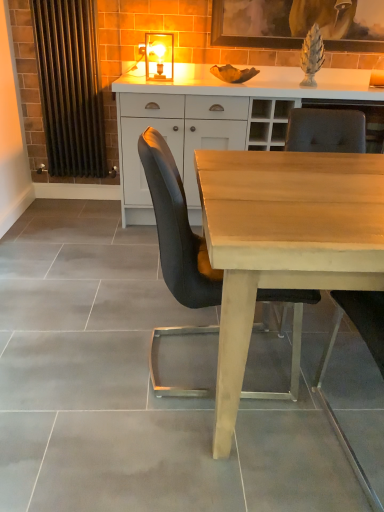
In order to face matte black chair at center, which ranks as the first chair in left-to-right order, should I rotate leftwards or rightwards?

You should look right and rotate roughly 4.692 degrees.

What do you see at coordinates (326, 131) in the screenshot?
I see `matte wood chair at center, which is the second chair from left to right` at bounding box center [326, 131].

At what (x,y) coordinates should I click in order to perform the action: click on matte glass lampshade at upper center. Please return your answer as a coordinate pair (x, y). Looking at the image, I should click on (159, 56).

Is metallic radiator at left positioned with its back to matte glass lampshade at upper center?

metallic radiator at left does not have its back to matte glass lampshade at upper center.

Which of these two, metallic radiator at left or matte glass lampshade at upper center, stands shorter?

Standing shorter between the two is matte glass lampshade at upper center.

From the image's perspective, which is above, metallic radiator at left or matte glass lampshade at upper center?

matte glass lampshade at upper center is shown above in the image.

Where is `curtain below the matte glass lampshade at upper center (from a real-world perspective)`? This screenshot has height=512, width=384. curtain below the matte glass lampshade at upper center (from a real-world perspective) is located at coordinates tap(70, 86).

Considering the points (239, 11) and (163, 34), which point is in front, point (239, 11) or point (163, 34)?

Positioned in front is point (239, 11).

You are a GUI agent. You are given a task and a screenshot of the screen. Output one action in this format:
    pyautogui.click(x=<x>, y=<y>)
    Task: Click on the picture frame above the matte glass lampshade at upper center (from the image's perspective)
    
    Given the screenshot: What is the action you would take?
    pyautogui.click(x=298, y=23)

Do you think wooden picture frame at upper center is within matte glass lampshade at upper center, or outside of it?

wooden picture frame at upper center is not enclosed by matte glass lampshade at upper center.

Is wooden picture frame at upper center with matte glass lampshade at upper center?

wooden picture frame at upper center and matte glass lampshade at upper center are not in contact.

Is wooden picture frame at upper center situated inside white matte cabinet at center or outside?

wooden picture frame at upper center cannot be found inside white matte cabinet at center.

Is wooden picture frame at upper center to the right of white matte cabinet at center from the viewer's perspective?

Yes, wooden picture frame at upper center is to the right of white matte cabinet at center.

Which object is further away from the camera taking this photo, wooden picture frame at upper center or white matte cabinet at center?

wooden picture frame at upper center is behind.

Does point (251, 3) lie in front of point (340, 89)?

No.

Considering the relative sizes of light brown wood desk at center and matte wood chair at center, the 1th chair from the right, in the image provided, is light brown wood desk at center wider than matte wood chair at center, the 1th chair from the right,?

Yes, light brown wood desk at center is wider than matte wood chair at center, the 1th chair from the right.

Is light brown wood desk at center taller than matte wood chair at center, which is the second chair from left to right?

No.

From the image's perspective, would you say light brown wood desk at center is shown under matte wood chair at center, the 1th chair from the right?

Indeed, from the image's perspective, light brown wood desk at center is shown beneath matte wood chair at center, the 1th chair from the right.

Based on their sizes in the image, would you say white matte cabinet at center is bigger or smaller than light brown wood desk at center?

Clearly, white matte cabinet at center is smaller in size than light brown wood desk at center.

Based on their positions, is white matte cabinet at center located to the left or right of light brown wood desk at center?

Based on their positions, white matte cabinet at center is located to the left of light brown wood desk at center.

Is white matte cabinet at center oriented away from light brown wood desk at center?

That's not correct — white matte cabinet at center is not looking away from light brown wood desk at center.

Is point (319, 96) closer to viewer compared to point (249, 261)?

No, (319, 96) is further to viewer.

Which point is more distant from viewer, [243,340] or [263,38]?

Point [263,38]

Is light brown wood desk at center next to wooden picture frame at upper center and touching it?

No, light brown wood desk at center is not with wooden picture frame at upper center.

From the image's perspective, is light brown wood desk at center positioned above or below wooden picture frame at upper center?

Based on their image positions, light brown wood desk at center is located beneath wooden picture frame at upper center.

In the scene shown: Is light brown wood desk at center outside of wooden picture frame at upper center?

Yes, light brown wood desk at center is not within wooden picture frame at upper center.

Based on their positions, is white matte cabinet at center located to the left or right of metallic radiator at left?

Based on their positions, white matte cabinet at center is located to the right of metallic radiator at left.

Is white matte cabinet at center closer to camera compared to metallic radiator at left?

Yes, white matte cabinet at center is closer to the viewer.

Where is `curtain located behind the white matte cabinet at center`? The image size is (384, 512). curtain located behind the white matte cabinet at center is located at coordinates pyautogui.click(x=70, y=86).

This screenshot has height=512, width=384. What are the coordinates of `curtain below the matte glass lampshade at upper center (from a real-world perspective)` in the screenshot? It's located at (70, 86).

What are the coordinates of `picture frame behind the matte glass lampshade at upper center` in the screenshot? It's located at (298, 23).

When comparing their distances from light brown wood desk at center, does matte glass lampshade at upper center or white matte cabinet at center seem further?

matte glass lampshade at upper center.

Which object lies further to the anchor point matte glass lampshade at upper center, wooden picture frame at upper center or matte wood chair at center, the 1th chair from the right?

matte wood chair at center, the 1th chair from the right, is positioned further to the anchor matte glass lampshade at upper center.

When comparing their distances from wooden picture frame at upper center, does light brown wood desk at center or matte black chair at center, which ranks as the first chair in left-to-right order, seem further?

Based on the image, matte black chair at center, which ranks as the first chair in left-to-right order, appears to be further to wooden picture frame at upper center.

Considering their positions, is light brown wood desk at center positioned further to matte wood chair at center, the 1th chair from the right, than white matte cabinet at center?

light brown wood desk at center is positioned further to the anchor matte wood chair at center, the 1th chair from the right.

Which object lies nearer to the anchor point matte glass lampshade at upper center, matte wood chair at center, the 1th chair from the right, or white matte cabinet at center?

white matte cabinet at center lies closer to matte glass lampshade at upper center than the other object.

From the picture: Looking at the image, which one is located further to metallic radiator at left, wooden picture frame at upper center or matte black chair at center, the second chair in the right-to-left sequence?

matte black chair at center, the second chair in the right-to-left sequence, is positioned further to the anchor metallic radiator at left.

Which object lies further to the anchor point matte wood chair at center, the 1th chair from the right, matte glass lampshade at upper center or white matte cabinet at center?

Based on the image, matte glass lampshade at upper center appears to be further to matte wood chair at center, the 1th chair from the right.

Looking at the image, which one is located closer to matte black chair at center, the second chair in the right-to-left sequence, matte wood chair at center, the 1th chair from the right, or white matte cabinet at center?

Among the two, matte wood chair at center, the 1th chair from the right, is located nearer to matte black chair at center, the second chair in the right-to-left sequence.

The height and width of the screenshot is (512, 384). I want to click on chair between matte black chair at center, which ranks as the first chair in left-to-right order, and wooden picture frame at upper center in the front-back direction, so click(x=326, y=131).

Locate an element on the screen. The width and height of the screenshot is (384, 512). cabinetry located between matte wood chair at center, the 1th chair from the right, and matte glass lampshade at upper center in the depth direction is located at coordinates (220, 106).

The height and width of the screenshot is (512, 384). I want to click on light fixture between wooden picture frame at upper center and matte wood chair at center, the 1th chair from the right, vertically, so click(159, 56).

I want to click on light fixture between metallic radiator at left and white matte cabinet at center in the horizontal direction, so click(159, 56).